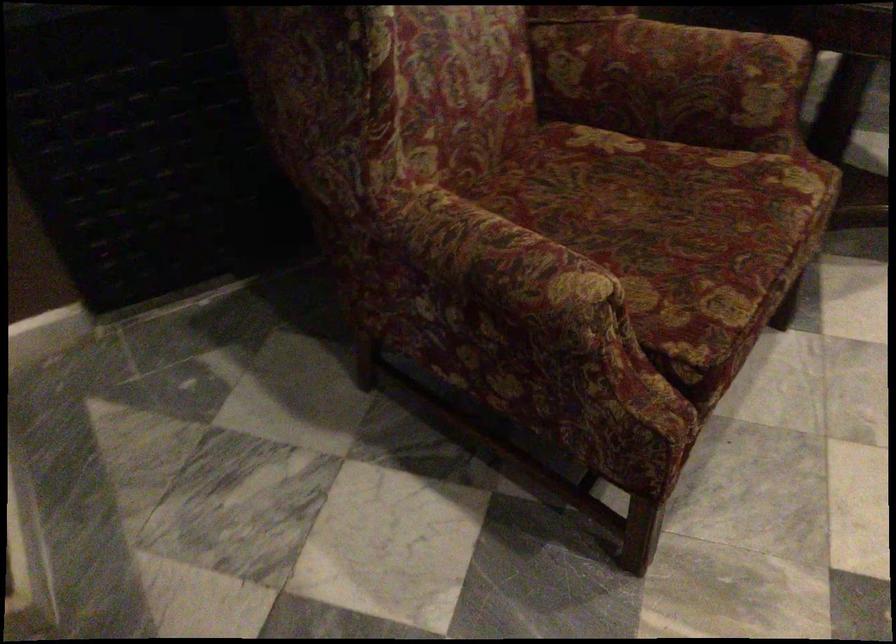
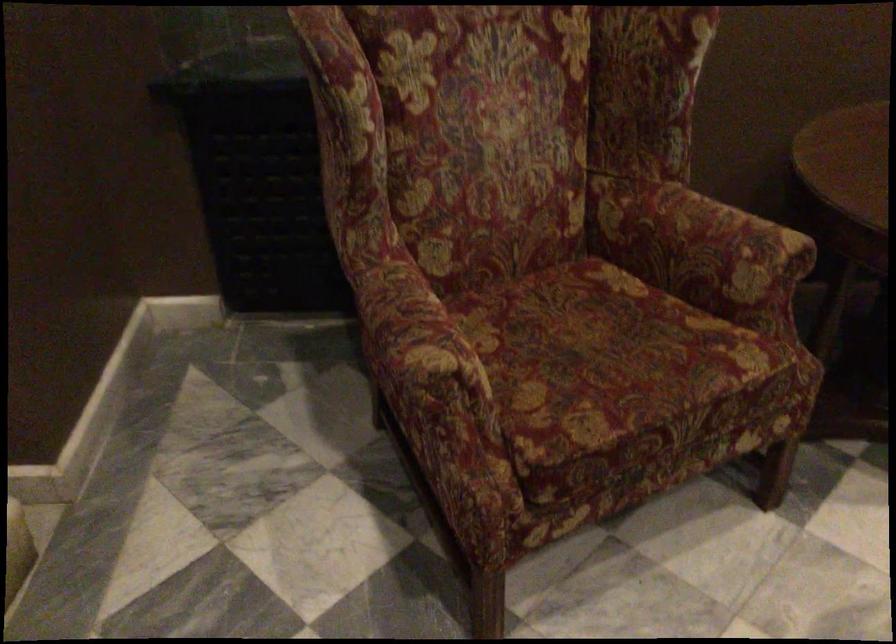
The point at (694,76) is marked in the first image. Where is the corresponding point in the second image?

(700, 243)